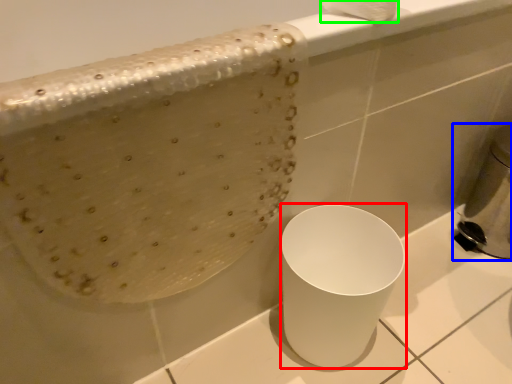
Question: Which object is positioned farthest from porcelain (highlighted by a red box)? Select from appliance (highlighted by a blue box) and toilet paper (highlighted by a green box).

Choices:
 (A) appliance
 (B) toilet paper

Answer: (A)